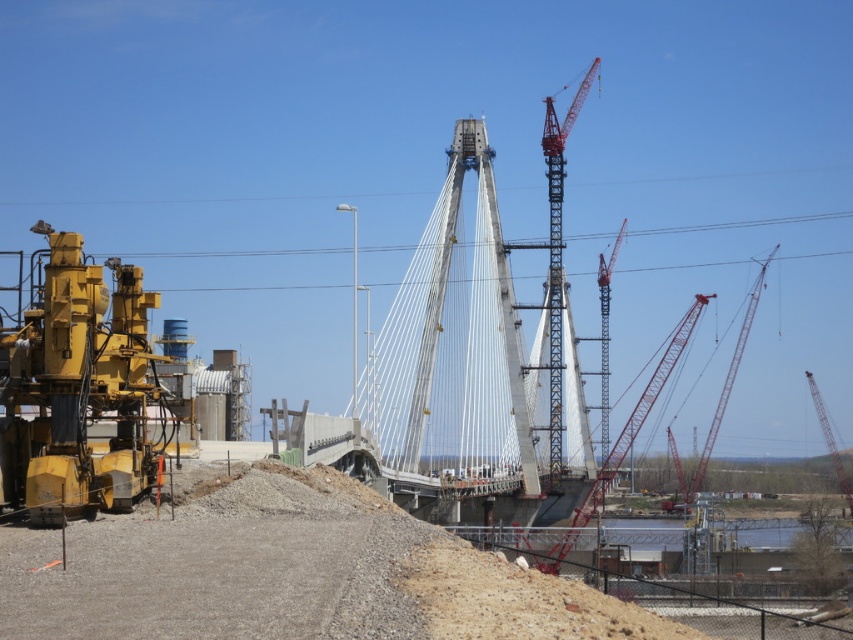
Which is above, red painted metal crane at center or red metal crane at center?

red painted metal crane at center is higher up.

Who is taller, red painted metal crane at center or red metal crane at center?

red painted metal crane at center is taller.

Between point (558, 317) and point (608, 444), which one is positioned in front?

Positioned in front is point (558, 317).

The height and width of the screenshot is (640, 853). I want to click on red painted metal crane at center, so click(x=556, y=257).

Which is below, brown gravel at lower left or red metal crane at right?

Positioned lower is red metal crane at right.

Is point (372, 522) positioned after point (833, 438)?

No, (372, 522) is in front of (833, 438).

Where is `brown gravel at lower left`? Image resolution: width=853 pixels, height=640 pixels. brown gravel at lower left is located at coordinates (291, 576).

The width and height of the screenshot is (853, 640). Find the location of `brown gravel at lower left`. brown gravel at lower left is located at coordinates (291, 576).

Between red metal crane at center and red metal crane at right, which one has less height?

With less height is red metal crane at right.

In the scene shown: Between red metal crane at center and red metal crane at right, which one is positioned lower?

Positioned lower is red metal crane at right.

Who is more forward, (605, 369) or (819, 422)?

Point (819, 422) is in front.

Where is `red metal crane at center`? The image size is (853, 640). red metal crane at center is located at coordinates (606, 333).